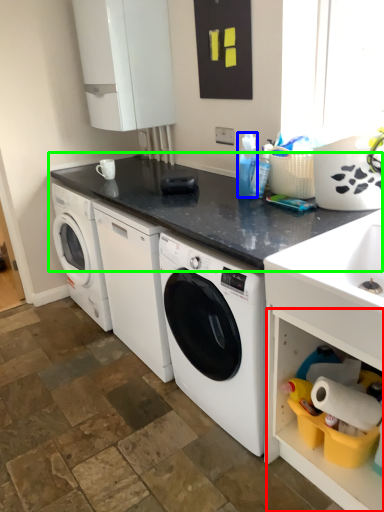
Question: Based on their relative distances, which object is farther from shelf (highlighted by a red box)? Choose from cleaning product (highlighted by a blue box) and countertop (highlighted by a green box).

Choices:
 (A) cleaning product
 (B) countertop

Answer: (A)